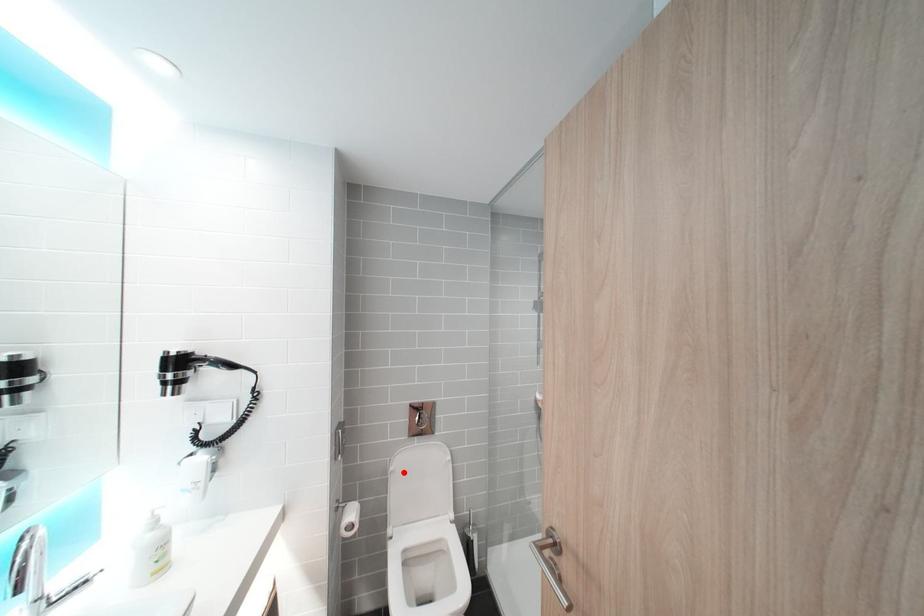
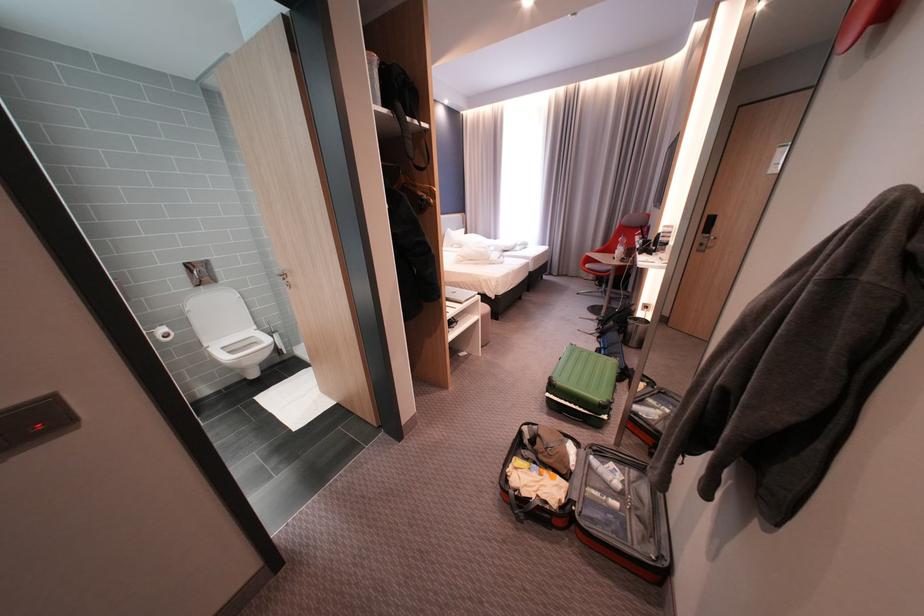
Find the pixel in the second image that matches the highlighted location in the first image.

(201, 312)